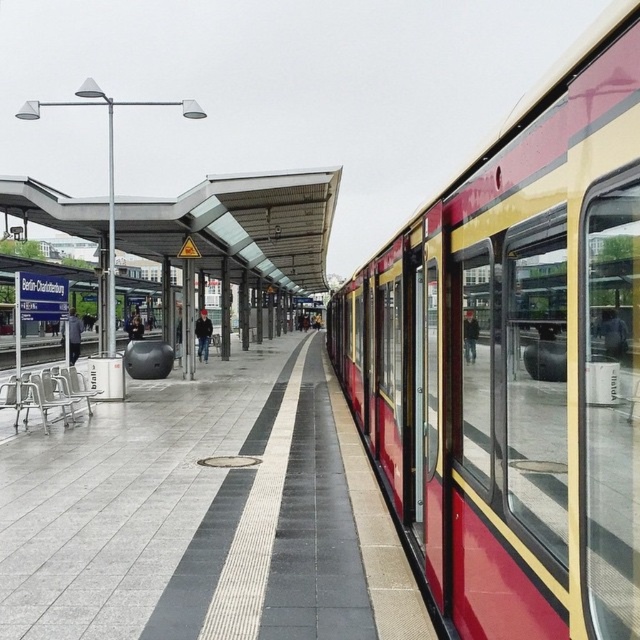
Can you confirm if red glossy train at right is thinner than concrete platform at center?

Yes.

Can you confirm if red glossy train at right is positioned to the right of concrete platform at center?

Indeed, red glossy train at right is positioned on the right side of concrete platform at center.

Is point (592, 392) in front of point (140, 600)?

Yes, it is in front of point (140, 600).

You are a GUI agent. You are given a task and a screenshot of the screen. Output one action in this format:
    pyautogui.click(x=<x>, y=<y>)
    Task: Click on the red glossy train at right
    This screenshot has width=640, height=640.
    Given the screenshot: What is the action you would take?
    pyautogui.click(x=516, y=362)